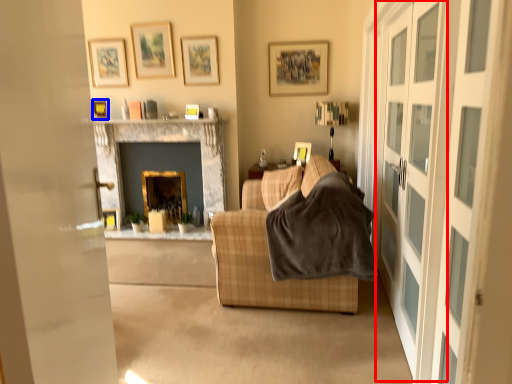
Question: Which of the following is the farthest to the observer, screen door (highlighted by a red box) or picture frame (highlighted by a blue box)?

Choices:
 (A) screen door
 (B) picture frame

Answer: (B)